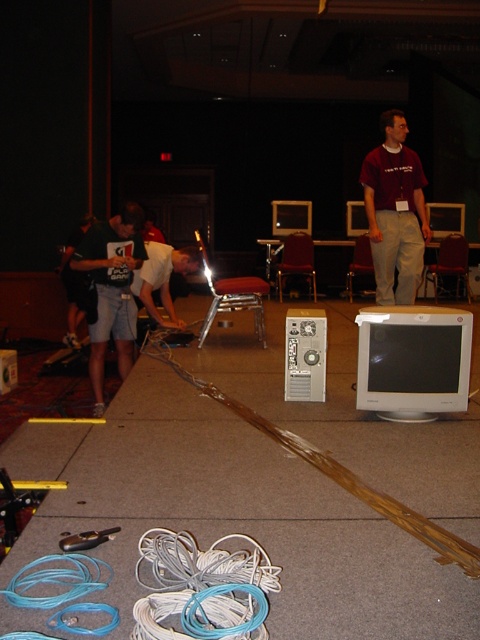
Question: Among these points, which one is farthest from the camera?

Choices:
 (A) (x=419, y=196)
 (B) (x=173, y=545)
 (C) (x=129, y=326)
 (D) (x=180, y=268)

Answer: (D)

Question: Can you confirm if dark gray shorts at left is positioned below white fabric shirt at center?

Choices:
 (A) no
 (B) yes

Answer: (B)

Question: Which of these objects is positioned closest to the white rubber wire at lower center?

Choices:
 (A) matte maroon shirt at center
 (B) white fabric shirt at center

Answer: (B)

Question: Does white rubber wire at lower center appear under matte maroon shirt at center?

Choices:
 (A) yes
 (B) no

Answer: (A)

Question: Which point is closer to the camera?

Choices:
 (A) (151, 634)
 (B) (190, 269)
 (C) (95, 413)

Answer: (A)

Question: Is white rubber wire at lower center closer to the viewer compared to matte maroon shirt at center?

Choices:
 (A) yes
 (B) no

Answer: (A)